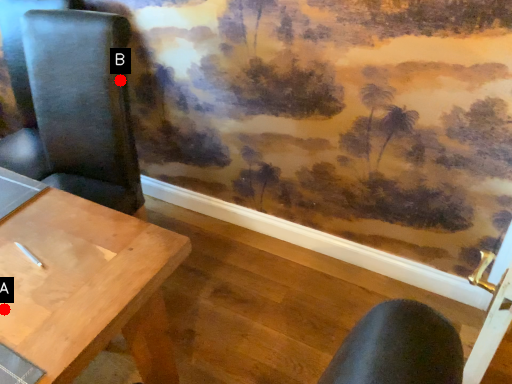
Question: Two points are circled on the image, labeled by A and B beside each circle. Which point is further to the camera?

Choices:
 (A) A is further
 (B) B is further

Answer: (B)